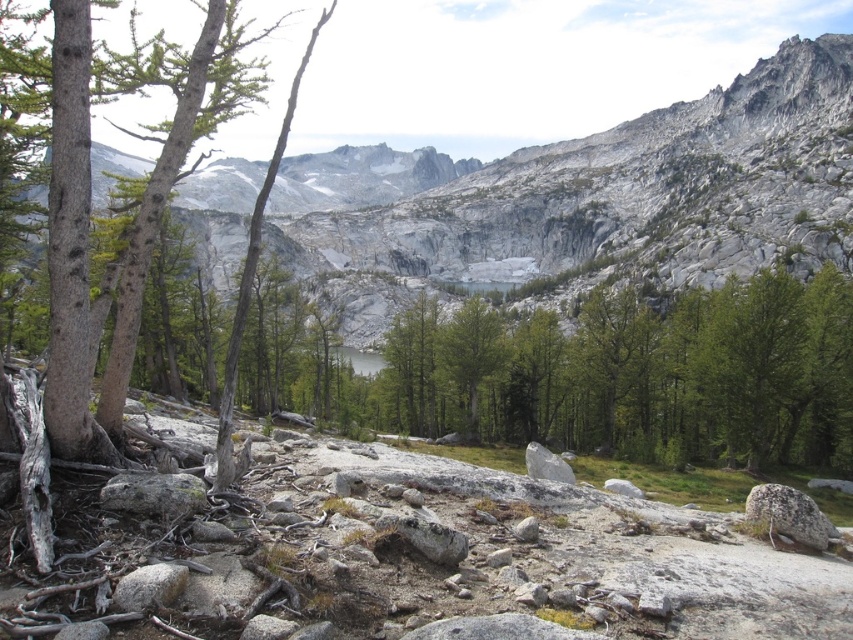
You are a hiker planning to climb the gray rock mountain at center and the green matte tree at center. Which one would require more effort to reach the top based on their heights?

The gray rock mountain at center is much taller than the green matte tree at center, so climbing the gray rock mountain at center would require more effort to reach the top.

You are a hiker planning to traverse from the smooth gray bark tree at left to the gray rock mountain at center. Given that your average walking pace is 1.4 meters per second, how many minutes will it take you to reach the mountain if you walk directly towards it?

The distance between the gray rock mountain at center and the smooth gray bark tree at left is 118.06 meters. At a walking pace of 1.4 meters per second, it would take approximately 118.06 divided by 1.4 equals 84.33 seconds, which is roughly 1.4 minutes. Therefore, it will take about 1.4 minutes to reach the gray rock mountain at center.

You are a hiker standing at the base of the mountain and want to reach the summit. Based on the image, what is the direction you should head to reach the gray rock mountain at center?

The gray rock mountain at center is located at point (606, 192), so you should head towards the center of the image to reach it.